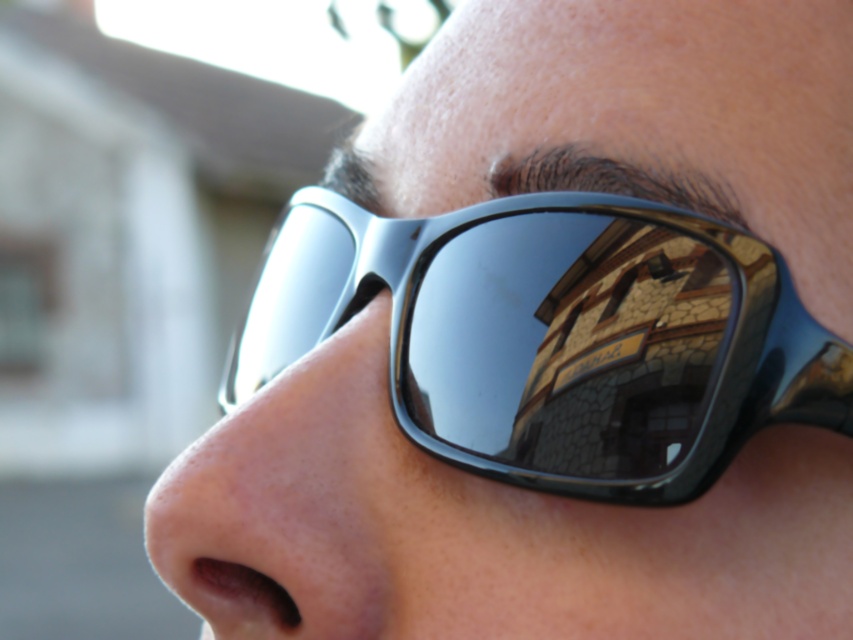
Question: Is black shiny sunglasses at center to the right of matte skin nose at lower left from the viewer's perspective?

Choices:
 (A) yes
 (B) no

Answer: (A)

Question: Which point is closer to the camera?

Choices:
 (A) black shiny sunglasses at center
 (B) matte skin nose at lower left

Answer: (A)

Question: Does black shiny sunglasses at center appear under matte skin nose at lower left?

Choices:
 (A) no
 (B) yes

Answer: (A)

Question: Does black shiny sunglasses at center have a greater width compared to matte skin nose at lower left?

Choices:
 (A) yes
 (B) no

Answer: (A)